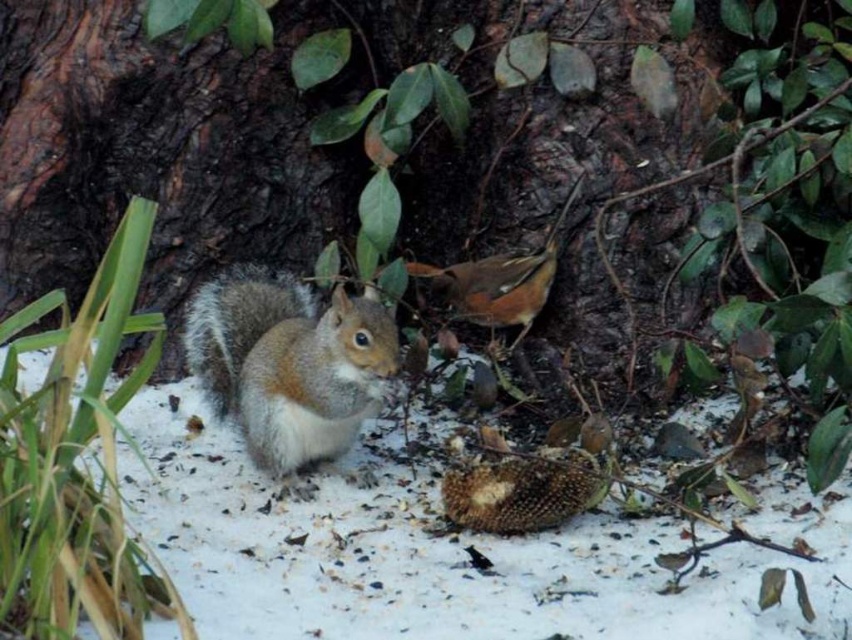
You are standing at the point marked by the coordinates point [291,368] in the snowy scene. Looking towards the direction of the small bird with reddish brown plumage and lighter underside, which object is directly in front of you?

The gray furred squirrel at center is directly in front of you since the point [291,368] represents the gray furred squirrel at center.